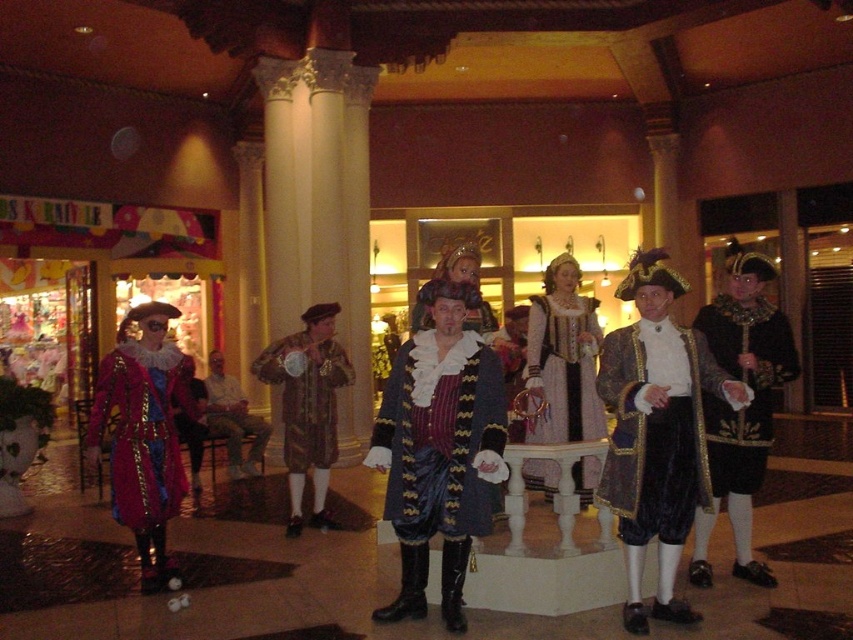
You are an event organizer who needs to decide which coat to place on a mannequin. The mannequin can only fit items that are larger than 1.2 meters in length. Given the brown velvet coat at center and the light brown leather jacket at center, which one is more likely to fit?

The light brown leather jacket at center is larger than the brown velvet coat at center, so it is more likely to fit on the mannequin that requires items larger than 1.2 meters in length.

You are standing in the shopping mall and looking at the Renaissance costume group. There are two points marked in the image. The first point is at coordinates point (306, 467) and the second point is at point (257, 465). Which point is closer to you?

Point (306, 467) is closer to the camera than point (257, 465).